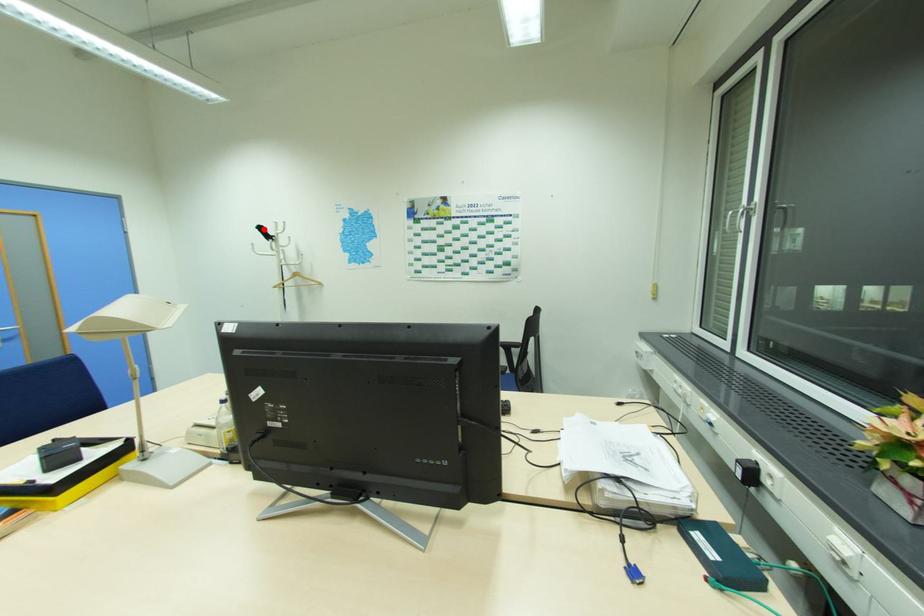
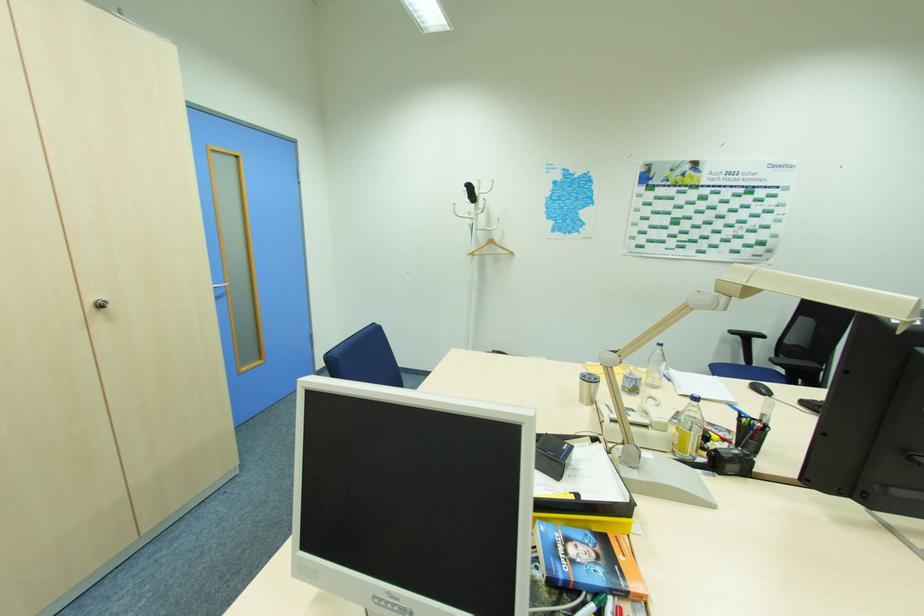
Where in the second image is the point corresponding to the highlighted location from the first image?

(472, 188)